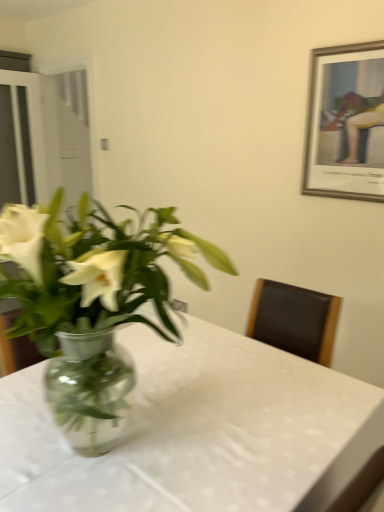
Where is `free point below clear glass vase at center (from a real-world perspective)`? The height and width of the screenshot is (512, 384). free point below clear glass vase at center (from a real-world perspective) is located at coordinates (117, 442).